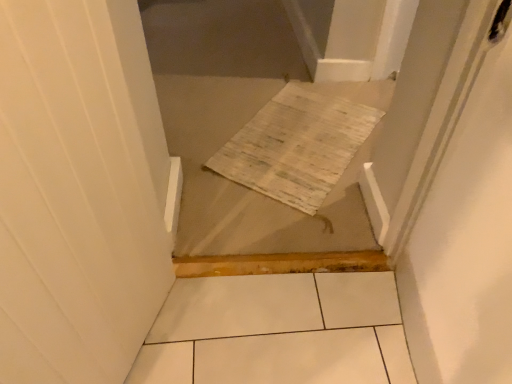
Question: Considering the positions of point (313, 97) and point (421, 152), is point (313, 97) closer or farther from the camera than point (421, 152)?

Choices:
 (A) closer
 (B) farther

Answer: (B)

Question: From a real-world perspective, relative to white glossy screen door at upper right, is woven fabric rug at center vertically above or below?

Choices:
 (A) above
 (B) below

Answer: (B)

Question: In terms of size, does woven fabric rug at center appear bigger or smaller than white glossy screen door at upper right?

Choices:
 (A) big
 (B) small

Answer: (B)

Question: From a real-world perspective, is white glossy screen door at upper right above or below woven fabric rug at center?

Choices:
 (A) below
 (B) above

Answer: (B)

Question: Does point (470, 36) appear closer or farther from the camera than point (301, 91)?

Choices:
 (A) closer
 (B) farther

Answer: (A)

Question: Considering their positions, is white glossy screen door at upper right located in front of or behind woven fabric rug at center?

Choices:
 (A) behind
 (B) front

Answer: (B)

Question: In terms of size, does white glossy screen door at upper right appear bigger or smaller than woven fabric rug at center?

Choices:
 (A) big
 (B) small

Answer: (A)